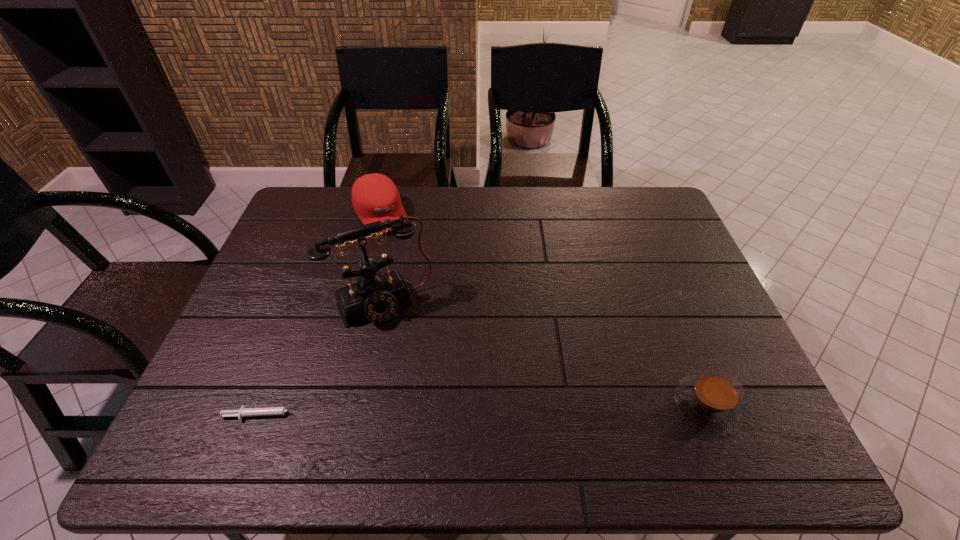
The width and height of the screenshot is (960, 540). I want to click on free space located 0.260m on the dial of the telephone, so click(x=442, y=408).

Where is `vacant space located on the dial of the telephone`? vacant space located on the dial of the telephone is located at coordinates (419, 360).

You are a GUI agent. You are given a task and a screenshot of the screen. Output one action in this format:
    pyautogui.click(x=<x>, y=<y>)
    Task: Click on the free space located on the front-facing side of the third shortest object
    Image resolution: width=960 pixels, height=540 pixels.
    Given the screenshot: What is the action you would take?
    pyautogui.click(x=442, y=313)

Identify the location of vacant space located on the front-facing side of the third shortest object. (404, 255).

Identify the location of free space located on the front-facing side of the third shortest object. The image size is (960, 540). (426, 288).

Image resolution: width=960 pixels, height=540 pixels. In order to click on object that is at the far edge in this screenshot , I will do `click(375, 197)`.

The height and width of the screenshot is (540, 960). I want to click on syringe situated at the near edge, so click(271, 411).

Identify the location of cappuccino located in the near edge section of the desktop. (712, 400).

Locate an element on the screen. The height and width of the screenshot is (540, 960). object located at the left edge is located at coordinates pyautogui.click(x=271, y=411).

Identify the location of object that is at the right edge. The height and width of the screenshot is (540, 960). (712, 400).